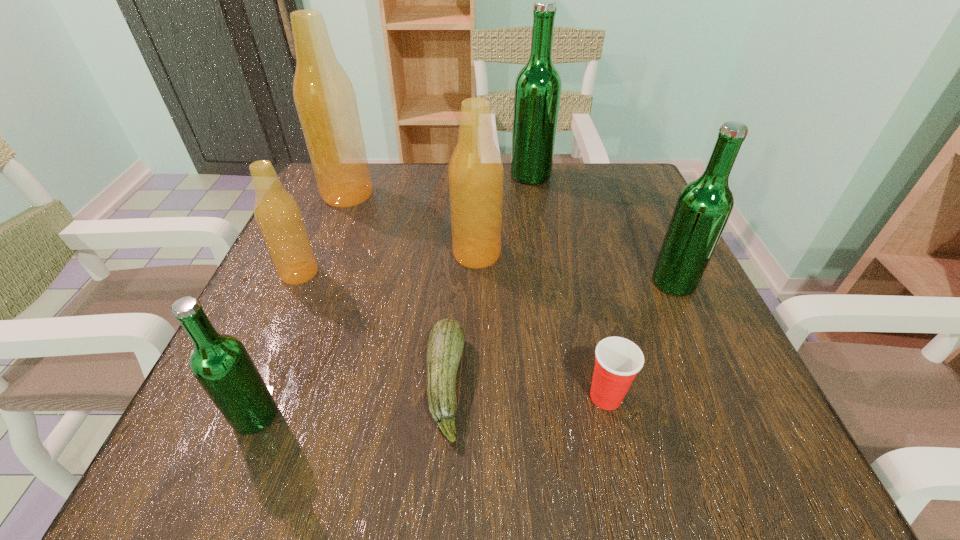
Locate an element on the screen. The width and height of the screenshot is (960, 540). free space at the left edge is located at coordinates (328, 270).

This screenshot has width=960, height=540. What are the coordinates of `free space at the right edge of the desktop` in the screenshot? It's located at (642, 261).

In the image, there is a desktop. Where is `free space at the near right corner`? free space at the near right corner is located at coordinates tap(727, 443).

Find the location of `unoccupied position between the second biggest green beer bottle and the shortest object`. unoccupied position between the second biggest green beer bottle and the shortest object is located at coordinates (560, 333).

This screenshot has height=540, width=960. Identify the location of free space between the second biggest tan beer bottle and the Dixie cup. (541, 325).

The image size is (960, 540). I want to click on empty space between the fifth beer bottle from left to right and the rightmost tan beer bottle, so click(x=504, y=214).

Identify the location of vacant space in between the nearest green beer bottle and the smallest tan beer bottle. (277, 345).

Where is `empty space between the farthest green beer bottle and the biggest tan beer bottle`? This screenshot has width=960, height=540. empty space between the farthest green beer bottle and the biggest tan beer bottle is located at coordinates (439, 185).

Find the location of a particular element. vacant area that lies between the leftmost green beer bottle and the rightmost beer bottle is located at coordinates (465, 349).

Locate an element on the screen. Image resolution: width=960 pixels, height=540 pixels. vacant region between the farthest green beer bottle and the rightmost object is located at coordinates (602, 228).